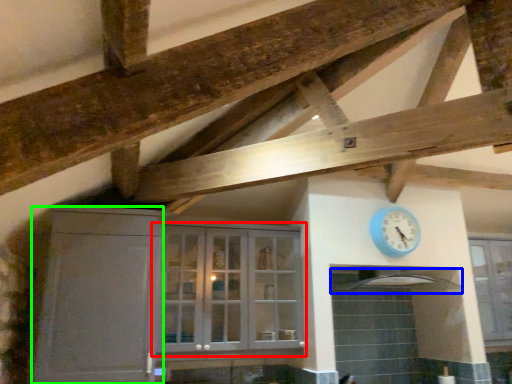
Question: Which object is positioned farthest from cupboard (highlighted by a red box)? Select from exhaust hood (highlighted by a blue box) and cabinetry (highlighted by a green box).

Choices:
 (A) exhaust hood
 (B) cabinetry

Answer: (A)